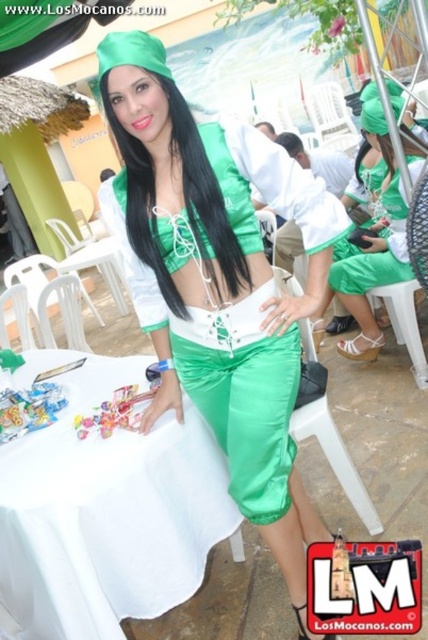
Is green silky hair at center bigger than black silky hair at center?

Incorrect, green silky hair at center is not larger than black silky hair at center.

Who is more forward, (98, 81) or (293, 141)?

Point (98, 81)

This screenshot has height=640, width=428. I want to click on green silky hair at center, so click(x=181, y=168).

Does shiny green pants at center appear on the left side of green silky hair at center?

No, shiny green pants at center is not to the left of green silky hair at center.

Is point (158, 333) closer to viewer compared to point (183, 301)?

No, it is not.

This screenshot has width=428, height=640. What are the coordinates of `shiny green pants at center` in the screenshot? It's located at (217, 282).

Which of these two, shiny green pants at center or green satin pants at center, stands taller?

shiny green pants at center

Can you confirm if shiny green pants at center is positioned to the left of green satin pants at center?

Yes, shiny green pants at center is to the left of green satin pants at center.

Between point (158, 336) and point (395, 196), which one is positioned in front?

Point (158, 336)

Identify the location of shiny green pants at center. (217, 282).